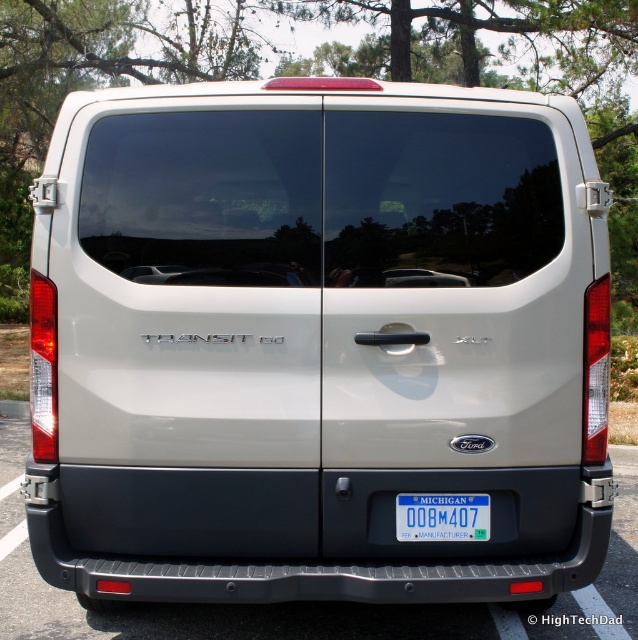
Consider the image. You are a delivery driver who needs to attach a magnetic sign to the Ford Transit van. The sign requires a minimum height of 15 cm to fit properly. Given the gray rubber bumper at lower center and the blue plastic license plate at center, which one can accommodate the sign based on their height?

The blue plastic license plate at center is taller than the gray rubber bumper at lower center. Since the sign requires a minimum height of 15 cm, the blue plastic license plate at center is the suitable location for attaching the magnetic sign.

You are a delivery driver who needs to attach a magnetic sign to the Ford Transit van. The sign is 12 inches wide. You have two options to place it either on the gray rubber bumper at lower center or the blue plastic license plate at center. Based on their widths, which location can securely hold the magnetic sign without overlapping?

The gray rubber bumper at lower center might be wider than blue plastic license plate at center, so the gray rubber bumper at lower center can securely hold the magnetic sign without overlapping.

You are standing behind the Ford Transit van and want to locate two points marked on its rear doors. The first point is at coordinate point (632, 568) and the second is at point (413, 538). From your current position, which point is closer to you?

Point (632, 568) is behind point (413, 538), so the point closer to you is point (413, 538).